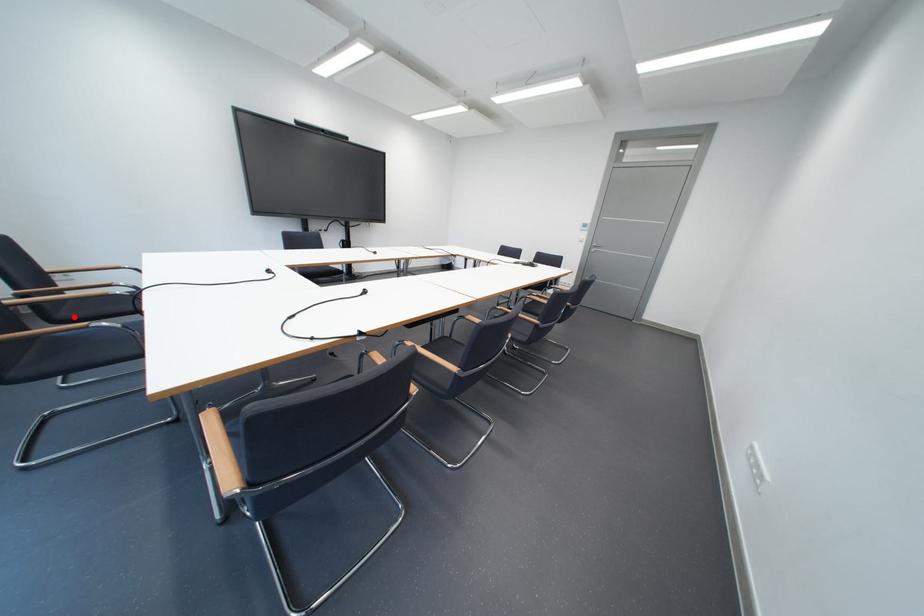
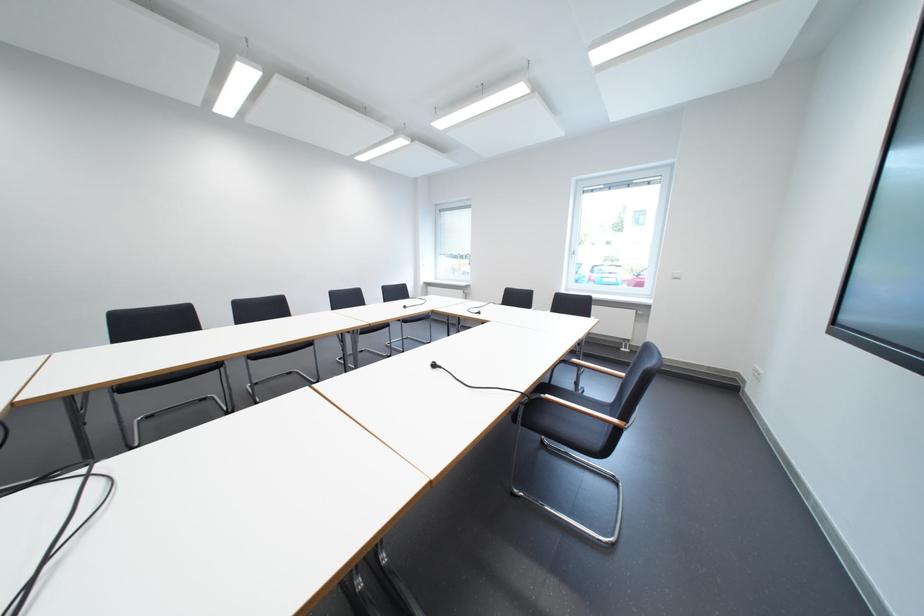
Question: I am providing you with two images of the same scene from different viewpoints. A red point is marked on the first image. Can you still see the location of the red point in image 2?

Choices:
 (A) Yes
 (B) No

Answer: (B)